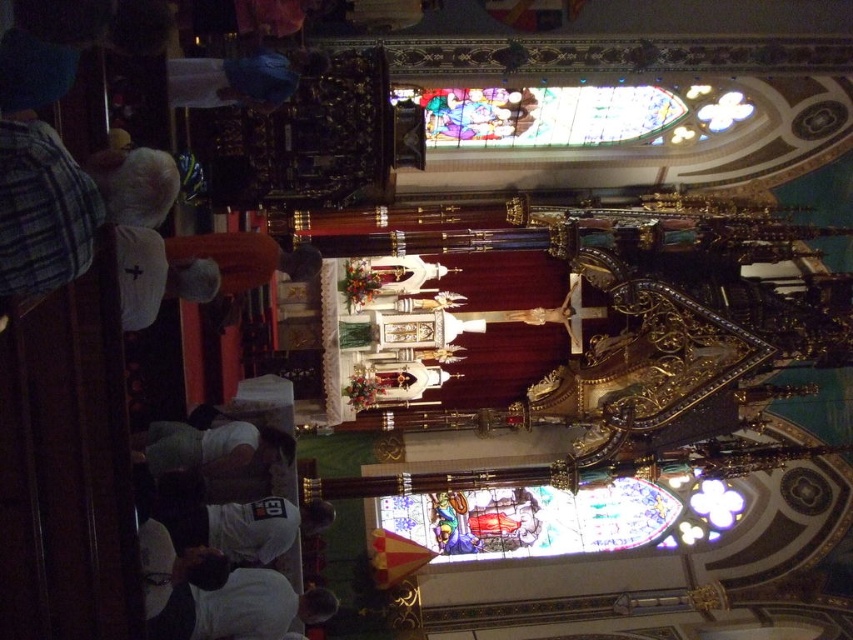
Question: Which object is closer to the camera taking this photo?

Choices:
 (A) white fabric at left
 (B) stained glass at upper center
 (C) white fabric at lower left

Answer: (A)

Question: Considering the real-world distances, which object is closest to the white porcelain statue at center?

Choices:
 (A) white fabric at lower center
 (B) gold metallic cross at center
 (C) white fabric at left
 (D) stained glass window at center

Answer: (B)

Question: Is stained glass window at center thinner than white fabric at left?

Choices:
 (A) yes
 (B) no

Answer: (B)

Question: Based on their relative distances, which object is nearer to the gold metallic cross at center?

Choices:
 (A) stained glass window at center
 (B) white fabric at lower center
 (C) white fabric at lower left
 (D) stained glass at upper center

Answer: (D)

Question: Does white fabric at lower left have a lesser width compared to white fabric at lower center?

Choices:
 (A) no
 (B) yes

Answer: (A)

Question: Does stained glass at upper center have a greater width compared to white porcelain statue at center?

Choices:
 (A) no
 (B) yes

Answer: (B)